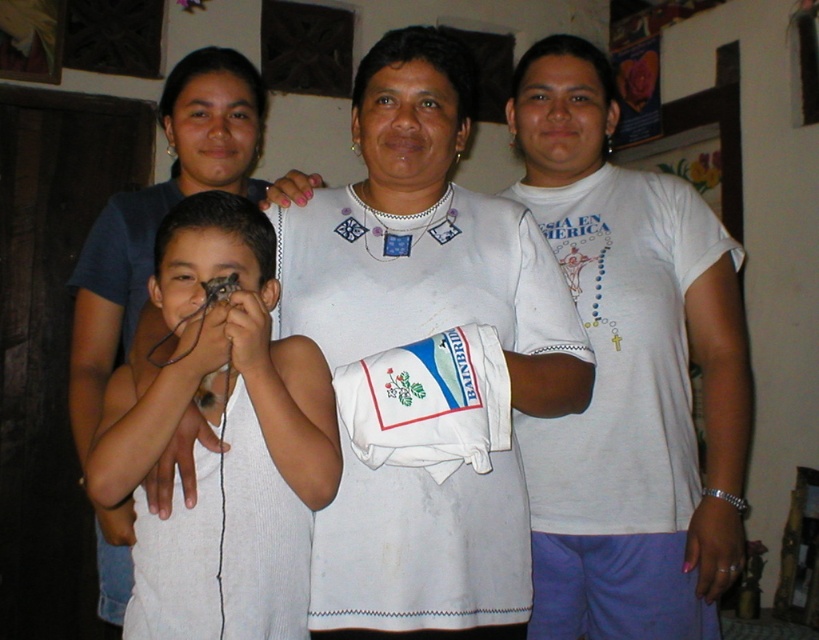
Is white cotton shirt at center closer to camera compared to white knitted tank top at center?

No, white cotton shirt at center is behind white knitted tank top at center.

Who is lower down, white cotton shirt at center or white knitted tank top at center?

Positioned lower is white knitted tank top at center.

Does point (673, 460) come closer to viewer compared to point (164, 611)?

No.

I want to click on white cotton shirt at center, so click(x=629, y=374).

Can you confirm if white embroidered dress at center is wider than white cotton shirt at center?

Correct, the width of white embroidered dress at center exceeds that of white cotton shirt at center.

Which is more to the left, white embroidered dress at center or white cotton shirt at center?

white embroidered dress at center

Does point (372, 285) come farther from viewer compared to point (657, 582)?

No, (372, 285) is in front of (657, 582).

Where is `white embroidered dress at center`? white embroidered dress at center is located at coordinates (x=424, y=236).

Is point (541, 336) positioned behind point (134, 621)?

Yes, point (541, 336) is farther from viewer.

Does white embroidered dress at center have a lesser width compared to white knitted tank top at center?

No.

Between point (317, 266) and point (130, 422), which one is positioned behind?

Point (317, 266)

The width and height of the screenshot is (819, 640). Identify the location of white embroidered dress at center. (424, 236).